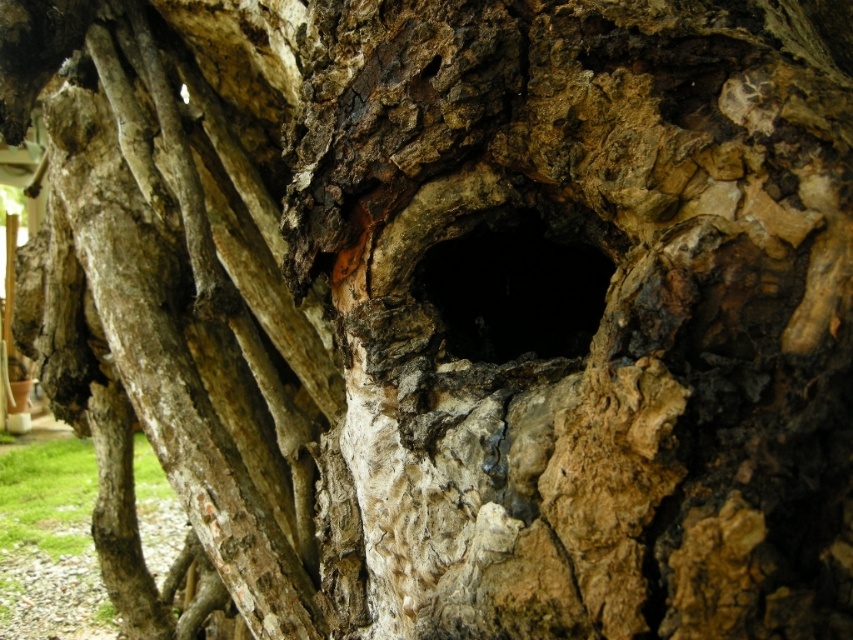
Question: Which point is closer to the camera?

Choices:
 (A) black rough hole at center
 (B) rough bark tree trunk at center

Answer: (B)

Question: Which point is closer to the camera?

Choices:
 (A) rough bark tree trunk at center
 (B) black rough hole at center

Answer: (A)

Question: Does rough bark tree trunk at center appear on the right side of black rough hole at center?

Choices:
 (A) yes
 (B) no

Answer: (B)

Question: From the image, what is the correct spatial relationship of rough bark tree trunk at center in relation to black rough hole at center?

Choices:
 (A) below
 (B) above

Answer: (B)

Question: Does rough bark tree trunk at center appear under black rough hole at center?

Choices:
 (A) no
 (B) yes

Answer: (A)